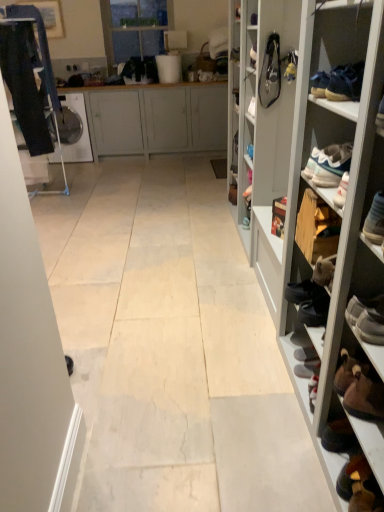
Question: Is transparent glass door at upper center to the right of leather bag at upper right, marked as the second shoe in a right-to-left arrangement, from the viewer's perspective?

Choices:
 (A) no
 (B) yes

Answer: (A)

Question: Is transparent glass door at upper center outside leather bag at upper right, marked as the second shoe in a right-to-left arrangement?

Choices:
 (A) yes
 (B) no

Answer: (A)

Question: Would you say transparent glass door at upper center contains leather bag at upper right, marked as the second shoe in a right-to-left arrangement?

Choices:
 (A) yes
 (B) no

Answer: (B)

Question: From the image's perspective, does transparent glass door at upper center appear lower than leather bag at upper right, marked as the second shoe in a right-to-left arrangement?

Choices:
 (A) no
 (B) yes

Answer: (A)

Question: Can you confirm if transparent glass door at upper center is bigger than leather bag at upper right, acting as the first shoe starting from the left?

Choices:
 (A) yes
 (B) no

Answer: (A)

Question: From a real-world perspective, is yellow fabric shoe at upper right, arranged as the 1th shoe when viewed from the right, positioned above or below leather bag at upper right, acting as the first shoe starting from the left?

Choices:
 (A) above
 (B) below

Answer: (A)

Question: Looking at the image, does yellow fabric shoe at upper right, arranged as the 1th shoe when viewed from the right, seem bigger or smaller compared to leather bag at upper right, acting as the first shoe starting from the left?

Choices:
 (A) small
 (B) big

Answer: (A)

Question: Looking at their shapes, would you say yellow fabric shoe at upper right, the second shoe in the left-to-right sequence, is wider or thinner than leather bag at upper right, marked as the second shoe in a right-to-left arrangement?

Choices:
 (A) thin
 (B) wide

Answer: (A)

Question: Based on their positions, is yellow fabric shoe at upper right, the second shoe in the left-to-right sequence, located to the left or right of leather bag at upper right, acting as the first shoe starting from the left?

Choices:
 (A) right
 (B) left

Answer: (A)

Question: Considering the relative positions of matte gray cabinet at center and yellow fabric shoe at upper right, arranged as the 1th shoe when viewed from the right, in the image provided, is matte gray cabinet at center to the left or to the right of yellow fabric shoe at upper right, arranged as the 1th shoe when viewed from the right,?

Choices:
 (A) left
 (B) right

Answer: (A)

Question: Is point (109, 129) positioned closer to the camera than point (284, 72)?

Choices:
 (A) farther
 (B) closer

Answer: (A)

Question: Is matte gray cabinet at center wider or thinner than yellow fabric shoe at upper right, the second shoe in the left-to-right sequence?

Choices:
 (A) wide
 (B) thin

Answer: (A)

Question: From a real-world perspective, is matte gray cabinet at center above or below yellow fabric shoe at upper right, arranged as the 1th shoe when viewed from the right?

Choices:
 (A) above
 (B) below

Answer: (B)

Question: From the image's perspective, is leather bag at upper right, marked as the second shoe in a right-to-left arrangement, positioned above or below transparent glass door at upper center?

Choices:
 (A) below
 (B) above

Answer: (A)

Question: Considering the positions of leather bag at upper right, marked as the second shoe in a right-to-left arrangement, and transparent glass door at upper center in the image, is leather bag at upper right, marked as the second shoe in a right-to-left arrangement, bigger or smaller than transparent glass door at upper center?

Choices:
 (A) small
 (B) big

Answer: (A)